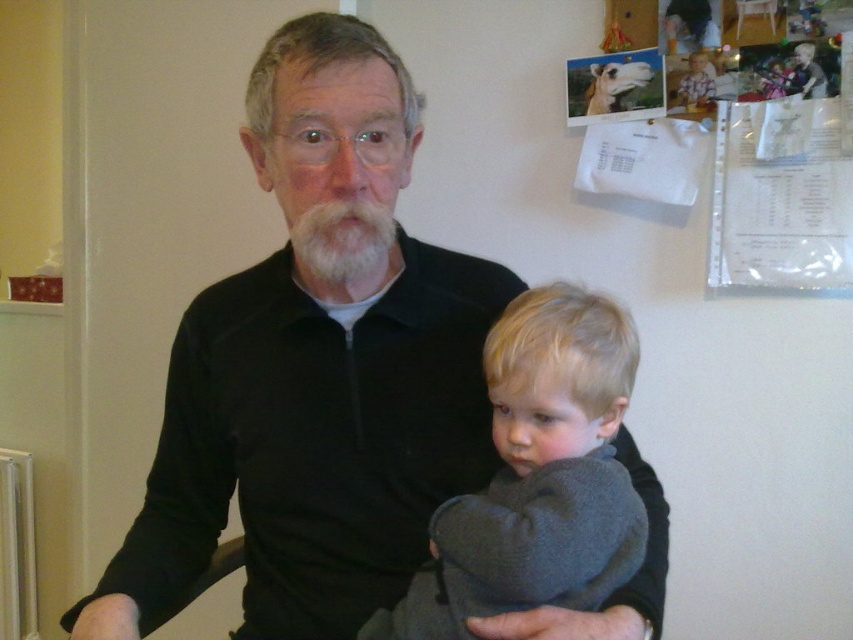
Question: Does gray fleece jacket at center have a larger size compared to white fuzzy beard at center?

Choices:
 (A) no
 (B) yes

Answer: (B)

Question: Which point is closer to the camera?

Choices:
 (A) white fuzzy beard at center
 (B) gray fleece jacket at center
 (C) black zip-up sweater at center
 (D) black smooth arm at center

Answer: (B)

Question: Does black zip-up sweater at center have a lesser width compared to white fuzzy beard at center?

Choices:
 (A) yes
 (B) no

Answer: (B)

Question: Can you confirm if gray fleece jacket at center is positioned above white fuzzy beard at center?

Choices:
 (A) no
 (B) yes

Answer: (A)

Question: Which is nearer to the gray fleece jacket at center?

Choices:
 (A) black zip-up sweater at center
 (B) black smooth arm at center
 (C) white fuzzy beard at center

Answer: (A)

Question: Which point appears farthest from the camera in this image?

Choices:
 (A) (312, 241)
 (B) (146, 538)

Answer: (B)